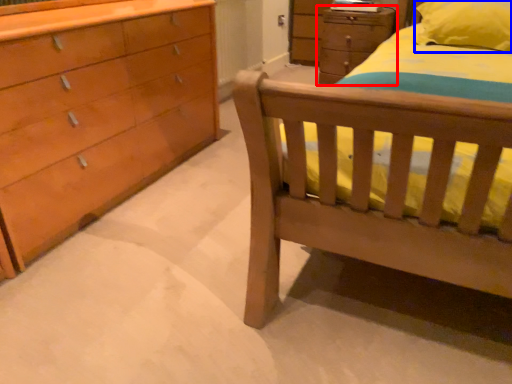
Question: Which object appears farthest to the camera in this image, chest of drawers (highlighted by a red box) or pillow (highlighted by a blue box)?

Choices:
 (A) chest of drawers
 (B) pillow

Answer: (A)